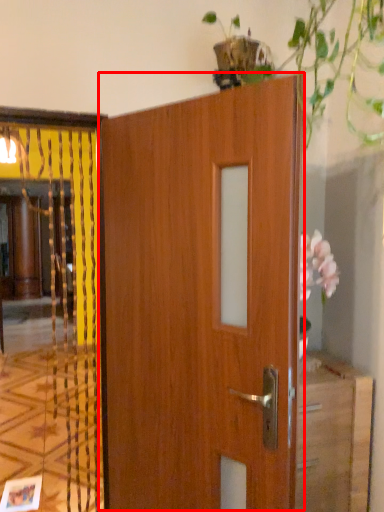
Question: From the image's perspective, considering the relative positions of door (annotated by the red box) and elevator in the image provided, where is door (annotated by the red box) located with respect to the staircase?

Choices:
 (A) below
 (B) above

Answer: (A)